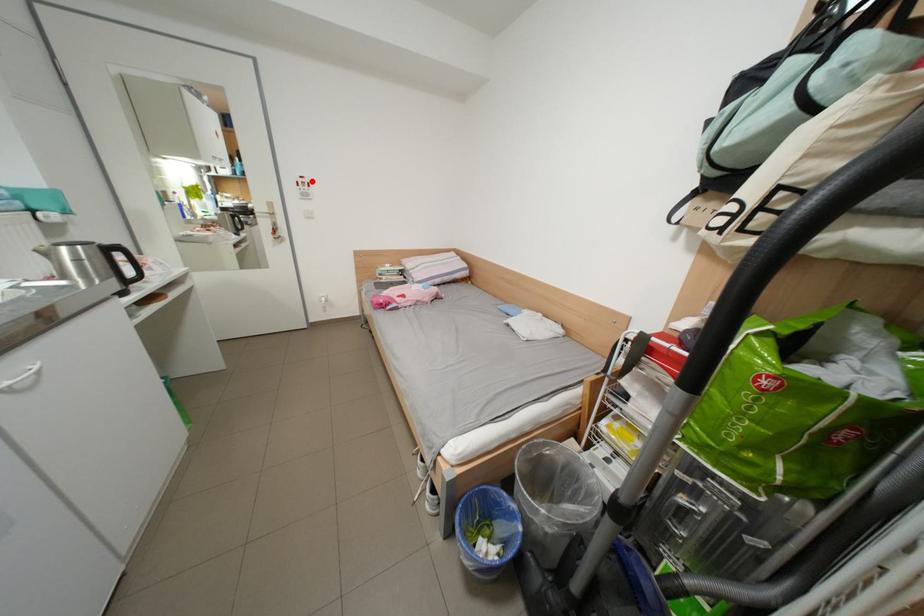
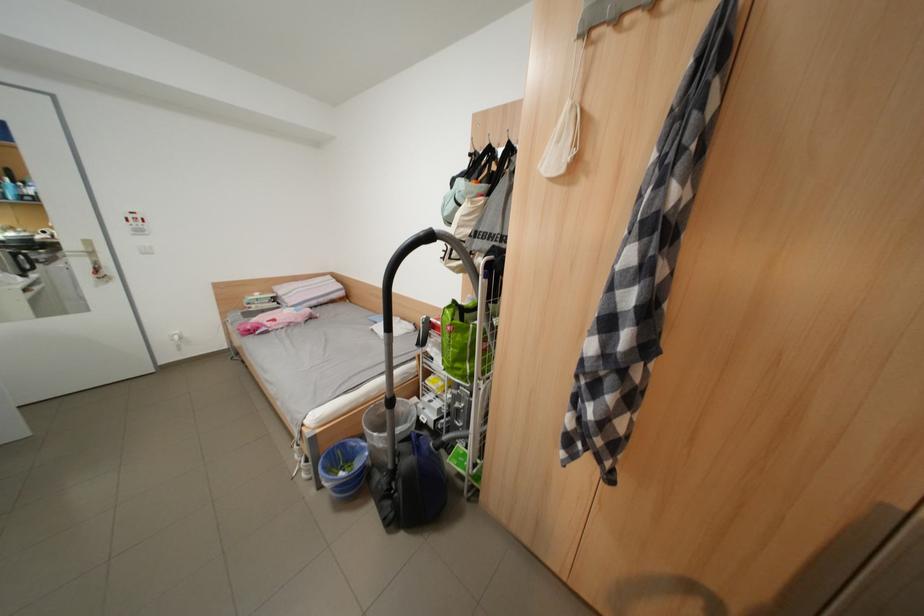
Question: I am providing you with two images of the same scene from different viewpoints. A red point is marked on the first image. Can you still see the location of the red point in image 2?

Choices:
 (A) Yes
 (B) No

Answer: (A)